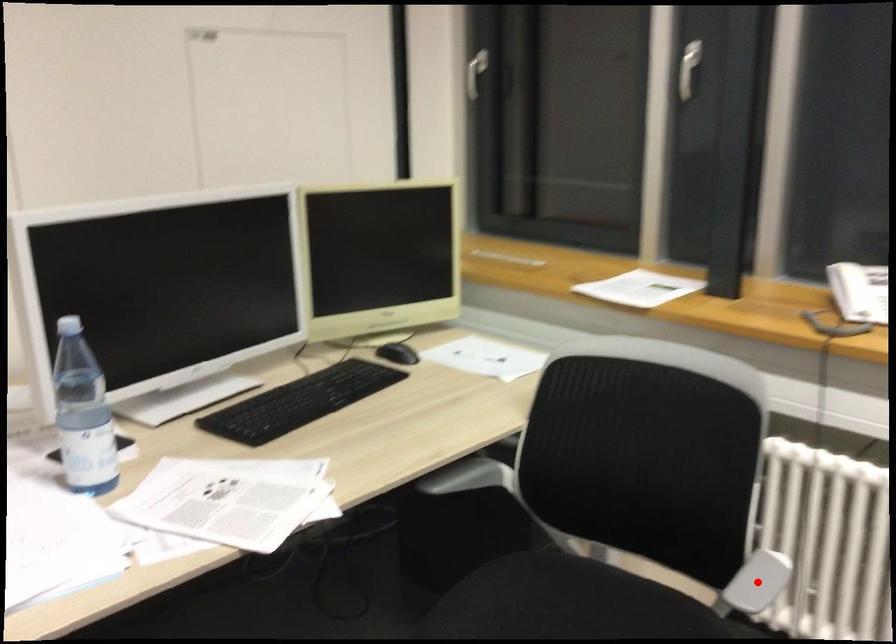
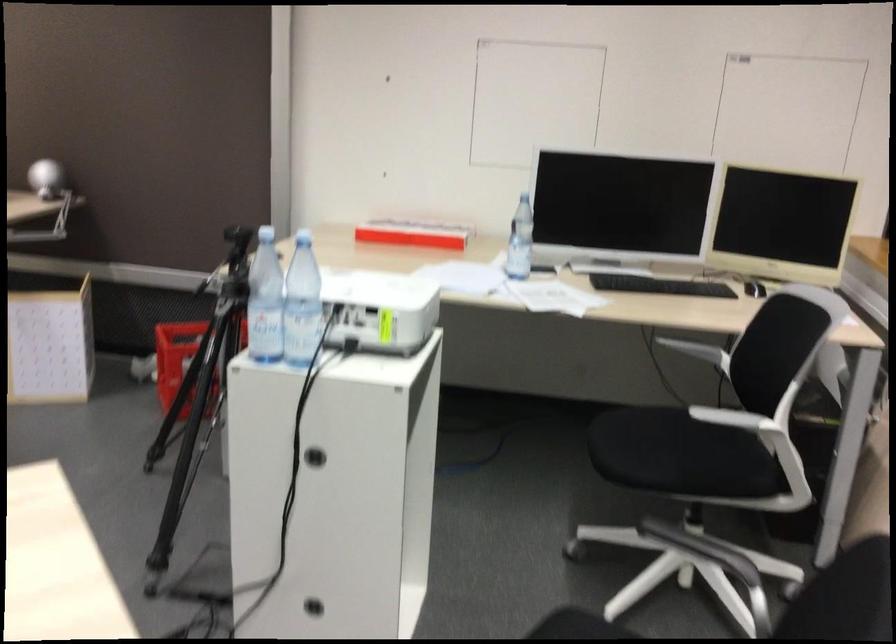
In the second image, find the point that corresponds to the highlighted location in the first image.

(730, 426)